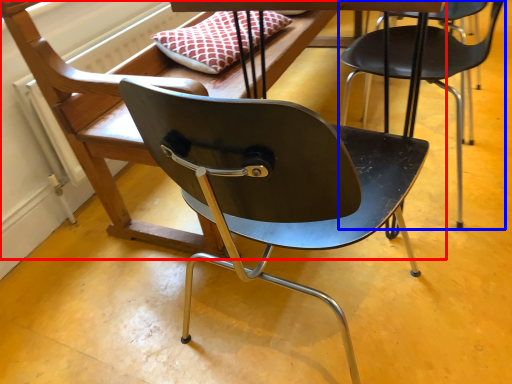
Question: Which object appears closest to the camera in this image, chair (highlighted by a red box) or chair (highlighted by a blue box)?

Choices:
 (A) chair
 (B) chair

Answer: (A)